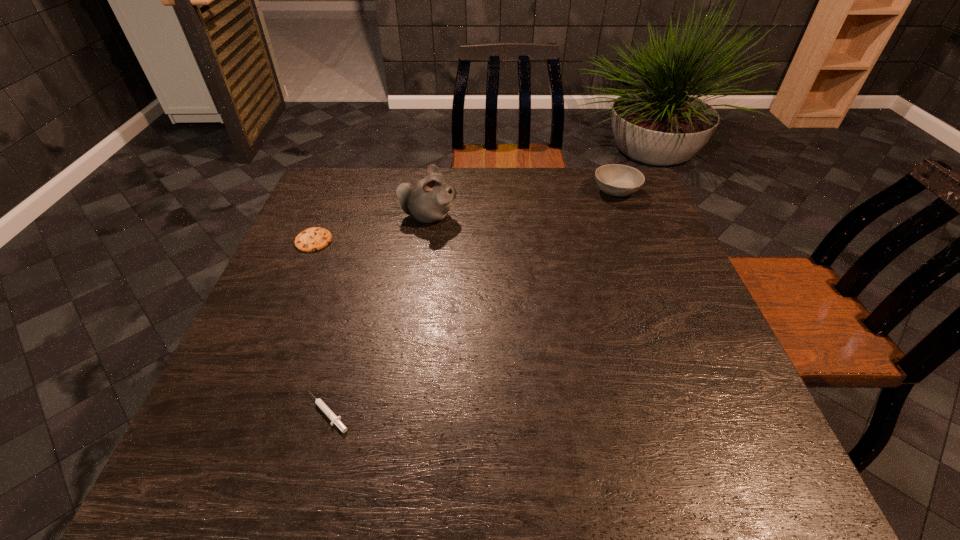
What are the coordinates of `blank space at the right edge of the desktop` in the screenshot? It's located at (639, 247).

Where is `vacant space at the far left corner of the desktop`? The height and width of the screenshot is (540, 960). vacant space at the far left corner of the desktop is located at coordinates (329, 199).

I want to click on free spot between the farthest object and the nearest object, so click(x=471, y=302).

Identify the location of empty space between the second object from right to left and the leftmost object. tap(372, 228).

The image size is (960, 540). I want to click on free space between the leftmost object and the nearest object, so click(x=321, y=327).

Find the location of a particular element. This screenshot has width=960, height=540. blank region between the leftmost object and the second object from left to right is located at coordinates (321, 327).

Locate an element on the screen. The width and height of the screenshot is (960, 540). empty location between the bowl and the syringe is located at coordinates (471, 302).

I want to click on empty space between the leftmost object and the third object from left to right, so click(372, 228).

The image size is (960, 540). I want to click on vacant space that's between the leftmost object and the nearest object, so click(x=321, y=327).

I want to click on free space between the cookie and the farthest object, so click(465, 216).